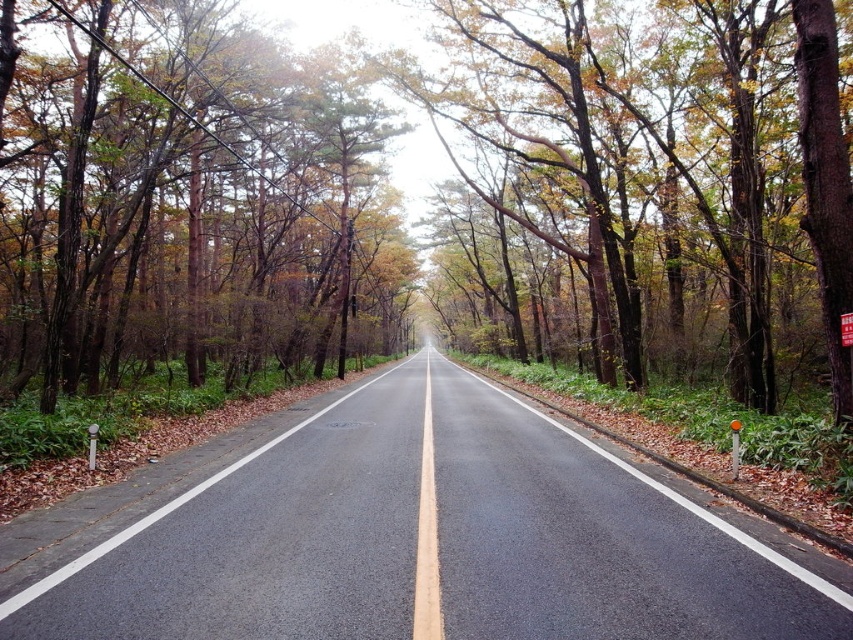
Question: Which point appears closest to the camera in this image?

Choices:
 (A) (206, 500)
 (B) (74, 192)

Answer: (A)

Question: Which of the following is the closest to the observer?

Choices:
 (A) brown wood tree at left
 (B) brown wood tree at center

Answer: (B)

Question: Where is brown wood tree at center located in relation to black asphalt road at center in the image?

Choices:
 (A) below
 (B) above

Answer: (B)

Question: Does black asphalt road at center have a smaller size compared to brown wood tree at left?

Choices:
 (A) no
 (B) yes

Answer: (B)

Question: Is the position of brown wood tree at center less distant than that of black asphalt road at center?

Choices:
 (A) yes
 (B) no

Answer: (B)

Question: Among these objects, which one is farthest from the camera?

Choices:
 (A) brown wood tree at left
 (B) brown wood tree at center

Answer: (A)